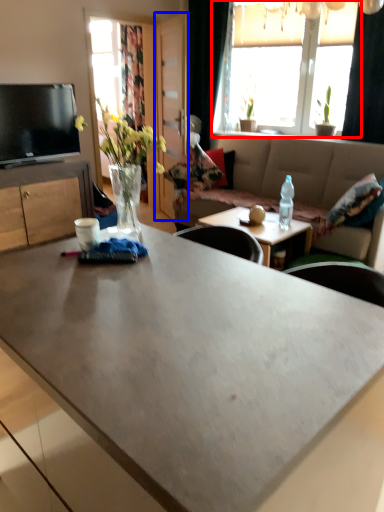
Question: Among these objects, which one is nearest to the camera, window (highlighted by a red box) or glass door (highlighted by a blue box)?

Choices:
 (A) window
 (B) glass door

Answer: (A)